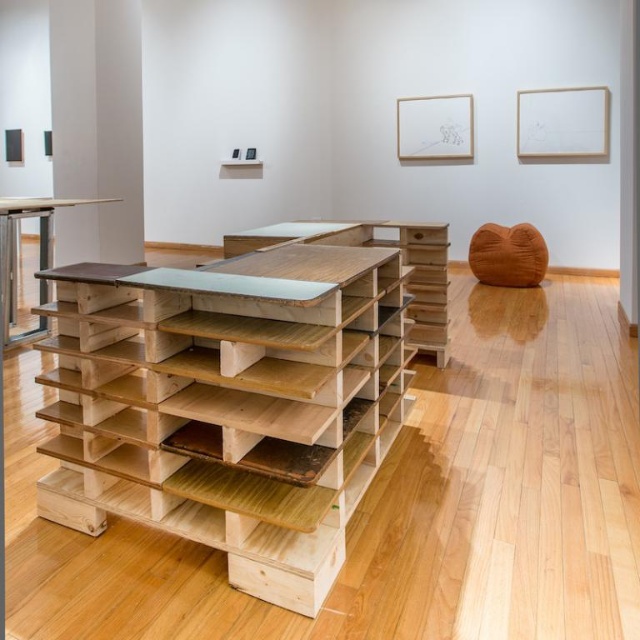
You are standing in the art gallery and want to take a closer look at the point at coordinates [372,420]. If your maximum reach is 5 feet, can you touch it without moving closer?

The point at coordinates [372,420] is 6.30 feet away from you, which exceeds your maximum reach of 5 feet. Therefore, you cannot touch it without moving closer.

You are standing in the art gallery and want to place a sculpture that is 5 feet tall on the natural wood table at left. Can the sculpture fit on the table?

The natural wood table at left is 6.39 feet from viewer. The height of the table itself is not provided, so we cannot determine if the sculpture will fit. Additional information about the table height is needed.